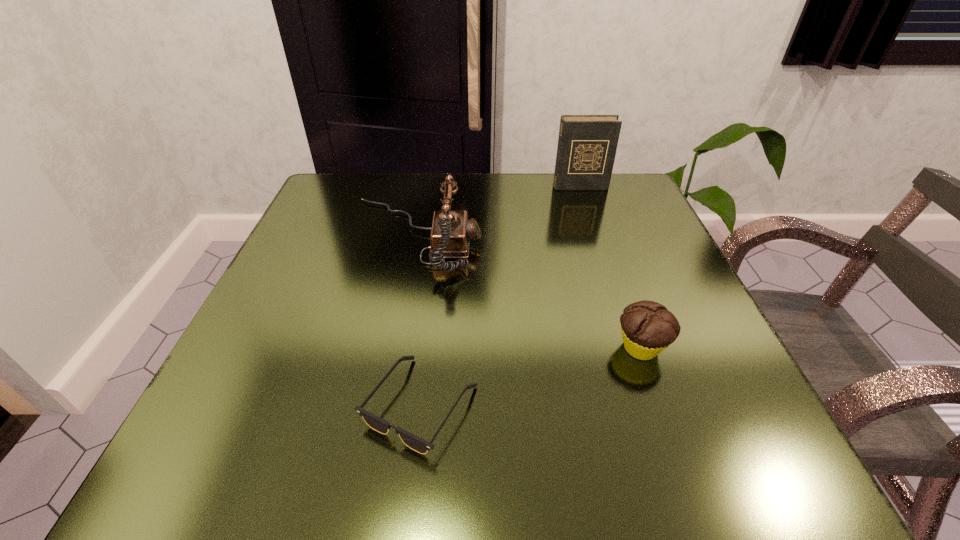
Locate an element on the screen. The width and height of the screenshot is (960, 540). telephone that is at the far edge is located at coordinates tap(451, 233).

At what (x,y) coordinates should I click in order to perform the action: click on object located at the near edge. Please return your answer as a coordinate pair (x, y). The width and height of the screenshot is (960, 540). Looking at the image, I should click on (414, 442).

Where is `object positioned at the left edge`? This screenshot has height=540, width=960. object positioned at the left edge is located at coordinates (451, 233).

The width and height of the screenshot is (960, 540). In order to click on diary present at the right edge in this screenshot , I will do `click(587, 144)`.

Image resolution: width=960 pixels, height=540 pixels. In order to click on muffin present at the right edge in this screenshot , I will do `click(647, 327)`.

Find the location of a particular element. The height and width of the screenshot is (540, 960). object that is positioned at the far left corner is located at coordinates (451, 233).

Locate an element on the screen. This screenshot has width=960, height=540. object that is at the far right corner is located at coordinates (587, 144).

Find the location of a particular element. vacant area at the far edge is located at coordinates (509, 208).

Locate an element on the screen. vacant space at the near edge of the desktop is located at coordinates (362, 468).

What are the coordinates of `vacant space at the left edge of the desktop` in the screenshot? It's located at [277, 279].